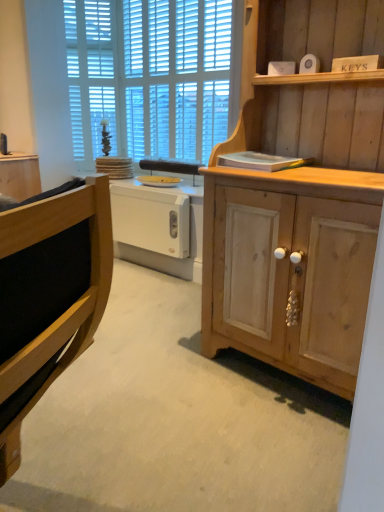
Where is `free point in front of natural wood cabinet at right, the 2th cabinetry from the back`? This screenshot has width=384, height=512. free point in front of natural wood cabinet at right, the 2th cabinetry from the back is located at coordinates (249, 446).